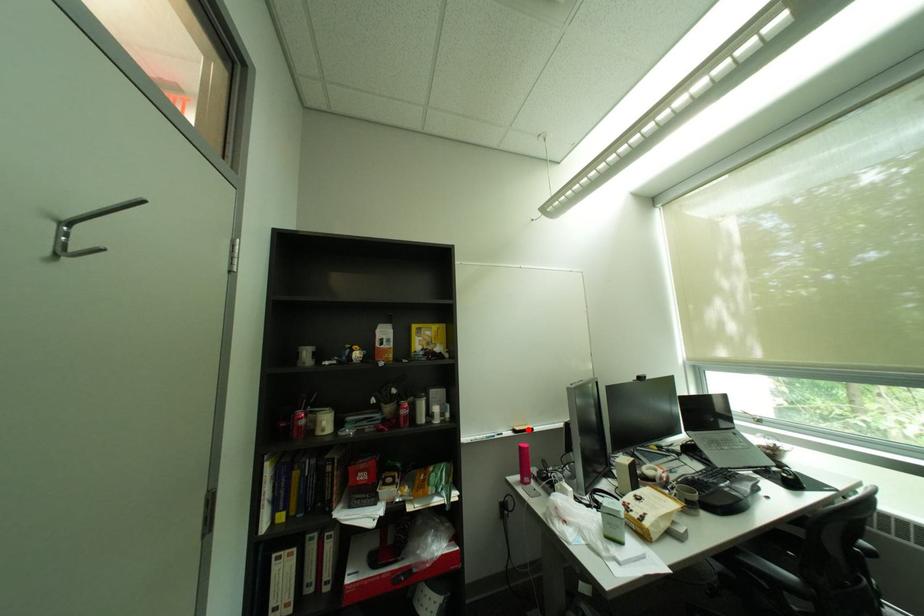
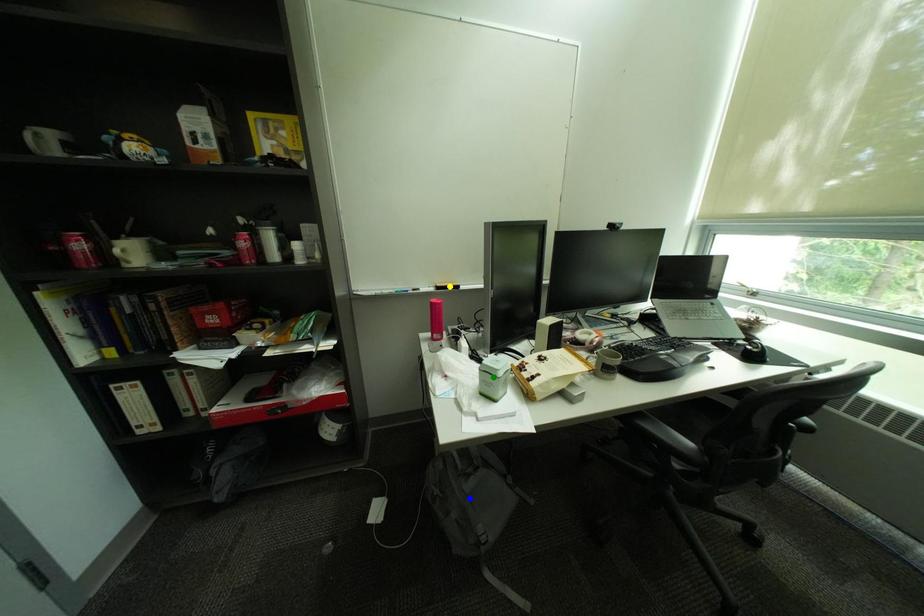
Question: I am providing you with two images of the same scene from different viewpoints. A red point is marked on the first image. You are given multiple points on the second image. Which spot in image 2 lines up with the point in image 1?

Choices:
 (A) blue point
 (B) green point
 (C) yellow point

Answer: (C)